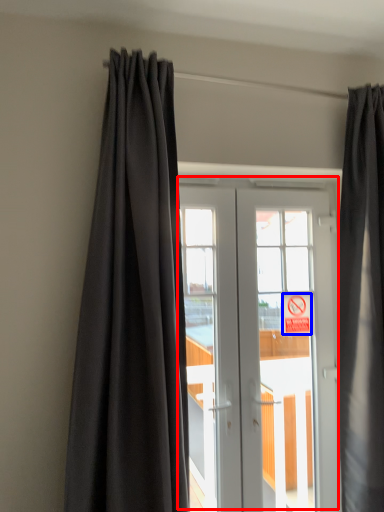
Question: Which point is further to the camera, door (highlighted by a red box) or parking sign (highlighted by a blue box)?

Choices:
 (A) door
 (B) parking sign

Answer: (B)